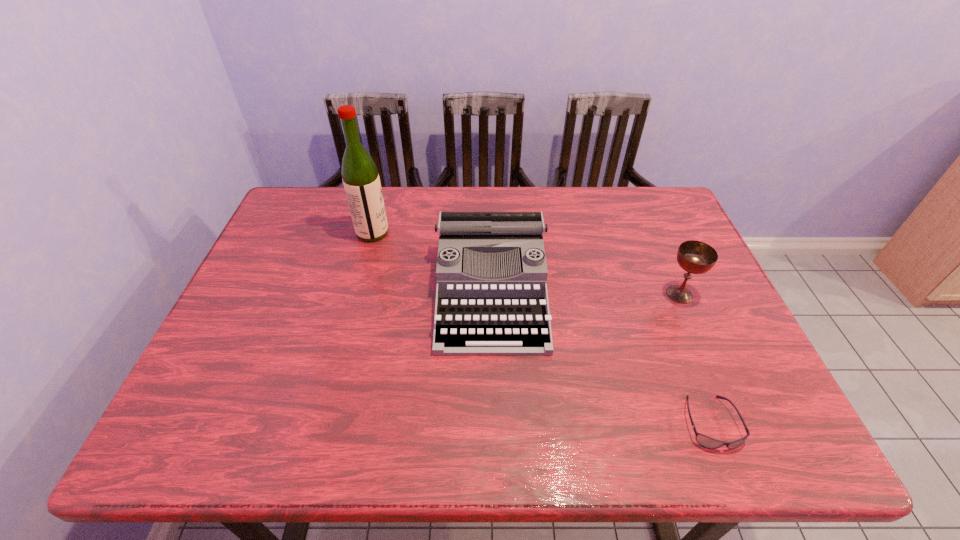
At what (x,y) coordinates should I click in order to perform the action: click on liquor. Please return your answer as a coordinate pair (x, y). Looking at the image, I should click on (360, 177).

Image resolution: width=960 pixels, height=540 pixels. Identify the location of the tallest object. (360, 177).

Where is `chalice`? Image resolution: width=960 pixels, height=540 pixels. chalice is located at coordinates (696, 257).

At what (x,y) coordinates should I click in order to perform the action: click on typewriter. Please return your answer as a coordinate pair (x, y). Looking at the image, I should click on (502, 309).

The height and width of the screenshot is (540, 960). Identify the location of the nearest object. (705, 441).

The image size is (960, 540). I want to click on sunglasses, so click(705, 441).

You are a GUI agent. You are given a task and a screenshot of the screen. Output one action in this format:
    pyautogui.click(x=<x>, y=<y>)
    Task: Click on the vacant area situated on the label of the tallest object
    This screenshot has height=540, width=960.
    Given the screenshot: What is the action you would take?
    pyautogui.click(x=419, y=233)

In order to click on vacant space situated on the back of the chalice in this screenshot , I will do `click(639, 202)`.

Find the location of `vacant area located 0.230m on the typing side of the typewriter`. vacant area located 0.230m on the typing side of the typewriter is located at coordinates (495, 453).

Where is `object that is at the far edge`? object that is at the far edge is located at coordinates (360, 177).